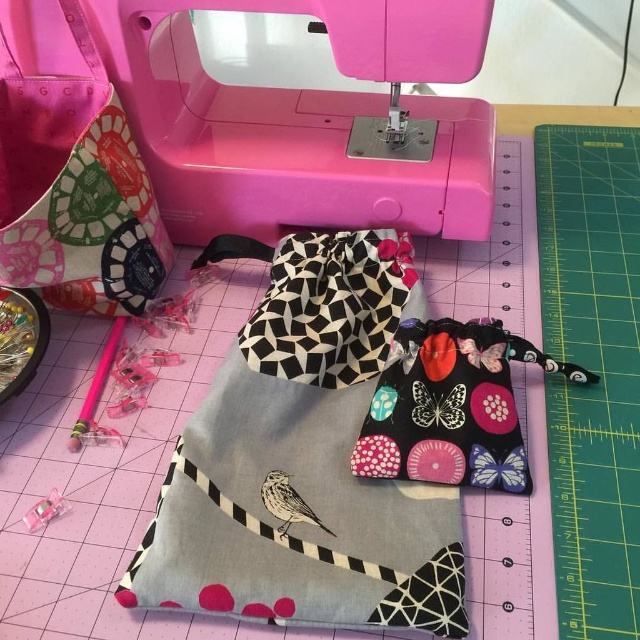
Question: Which object appears closest to the camera in this image?

Choices:
 (A) black fabric pouch with butterfly prints at center
 (B) multicolored fabric pouch at upper left
 (C) pink plastic sewing machine at upper center

Answer: (A)

Question: Does pink plastic sewing machine at upper center lie behind multicolored fabric pouch at upper left?

Choices:
 (A) no
 (B) yes

Answer: (B)

Question: Which point appears farthest from the camera in this image?

Choices:
 (A) (38, 115)
 (B) (440, 445)

Answer: (A)

Question: Where is pink plastic sewing machine at upper center located in relation to multicolored fabric pouch at upper left in the image?

Choices:
 (A) above
 (B) below

Answer: (A)

Question: Which point appears closest to the camera in this image?

Choices:
 (A) (451, 200)
 (B) (404, 394)
 (C) (72, 177)

Answer: (B)

Question: From the image, what is the correct spatial relationship of pink plastic sewing machine at upper center in relation to black fabric pouch with butterfly prints at center?

Choices:
 (A) below
 (B) above

Answer: (B)